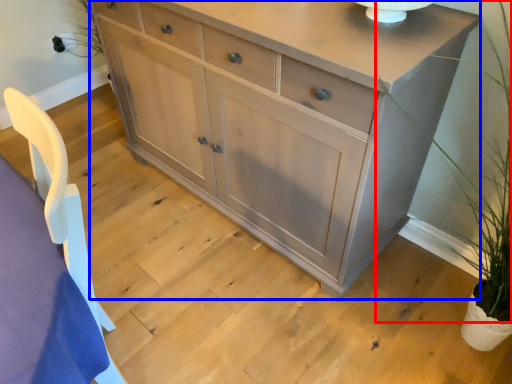
Question: Which point is further to the camera, plant (highlighted by a red box) or chest of drawers (highlighted by a blue box)?

Choices:
 (A) plant
 (B) chest of drawers

Answer: (B)